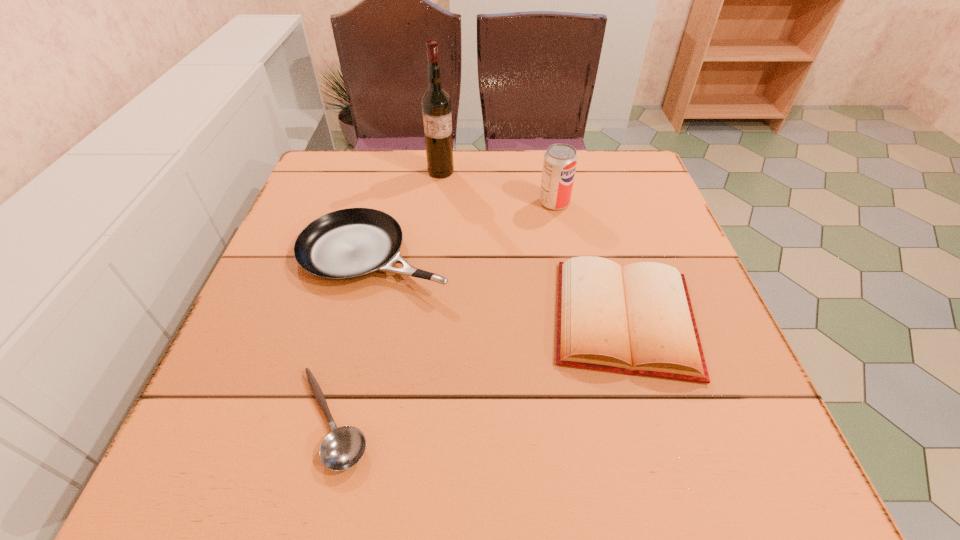
At what (x,y) coordinates should I click in order to perform the action: click on vacant space located on the back of the Bible. Please return your answer as a coordinate pair (x, y). The width and height of the screenshot is (960, 540). Looking at the image, I should click on (595, 218).

This screenshot has height=540, width=960. I want to click on free point located on the right of the shortest object, so click(x=622, y=419).

Locate an element on the screen. The width and height of the screenshot is (960, 540). wine bottle that is at the far edge is located at coordinates (436, 105).

Locate an element on the screen. The width and height of the screenshot is (960, 540). soda present at the far edge is located at coordinates (560, 160).

What are the coordinates of `object at the near edge` in the screenshot? It's located at (343, 447).

The height and width of the screenshot is (540, 960). Identify the location of pan that is positioned at the left edge. [347, 244].

This screenshot has height=540, width=960. What are the coordinates of `ladle located in the left edge section of the desktop` in the screenshot? It's located at (343, 447).

Identify the location of object that is at the right edge. The image size is (960, 540). (638, 320).

Locate an element on the screen. This screenshot has width=960, height=540. object present at the near left corner is located at coordinates (343, 447).

Identify the location of free region at the far edge of the desktop. 579,196.